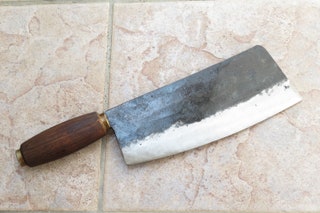
You are a GUI agent. You are given a task and a screenshot of the screen. Output one action in this format:
    pyautogui.click(x=<x>, y=<y>)
    Task: Click on the floor
    The width and height of the screenshot is (320, 213).
    Given the screenshot: What is the action you would take?
    pyautogui.click(x=170, y=41)